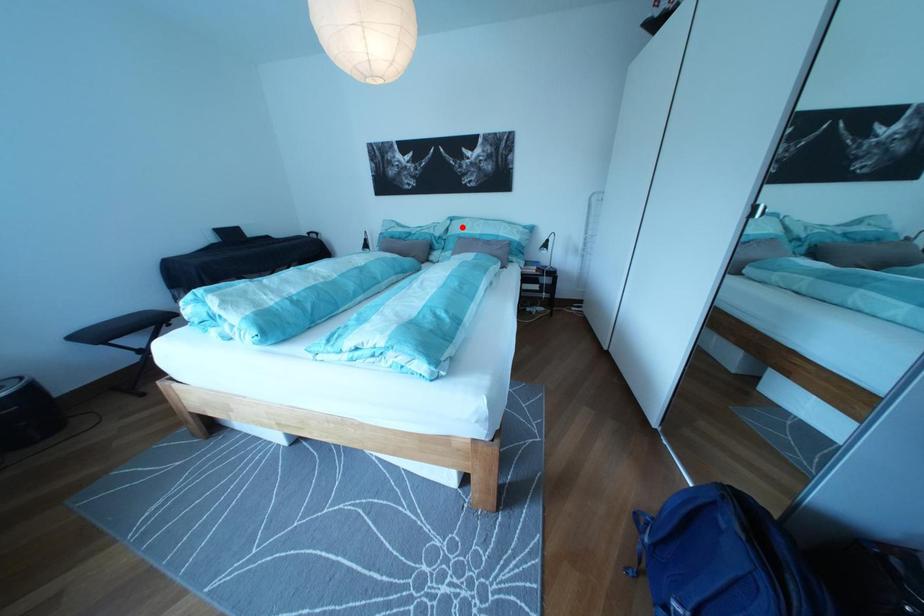
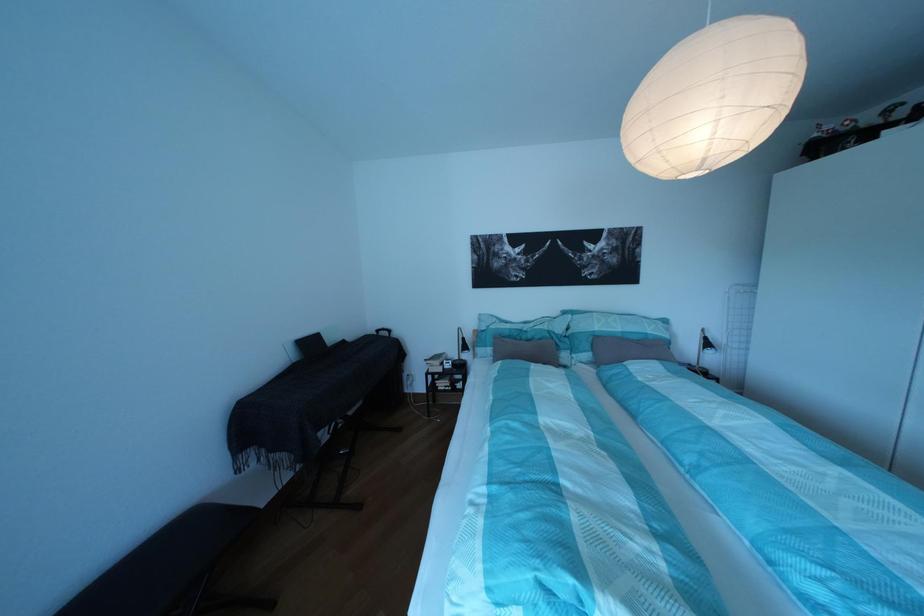
Question: I am providing you with two images of the same scene from different viewpoints. A red point is marked on the first image. At the location where the point appears in image 1, is it still visible in image 2?

Choices:
 (A) Yes
 (B) No

Answer: (A)